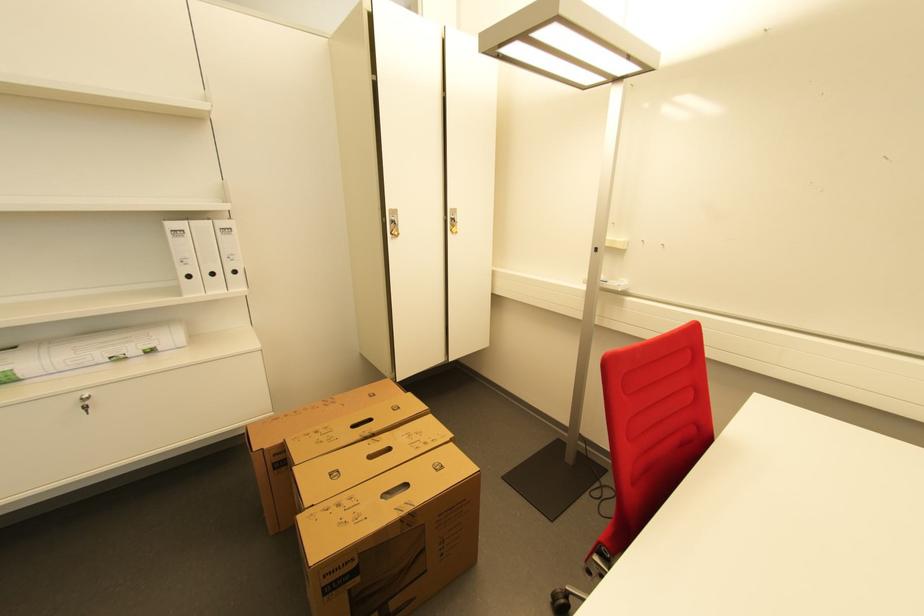
Find where to lift the rolled paper. Please return your answer as a coordinate pair (x, y).

(88, 350)